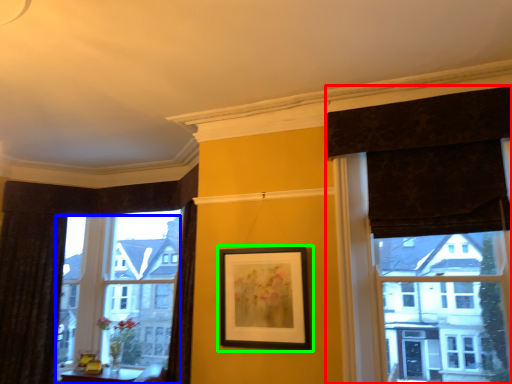
Question: Which object is the closest to the curtain (highlighted by a red box)? Choose among these: window (highlighted by a blue box) or picture frame (highlighted by a green box).

Choices:
 (A) window
 (B) picture frame

Answer: (B)